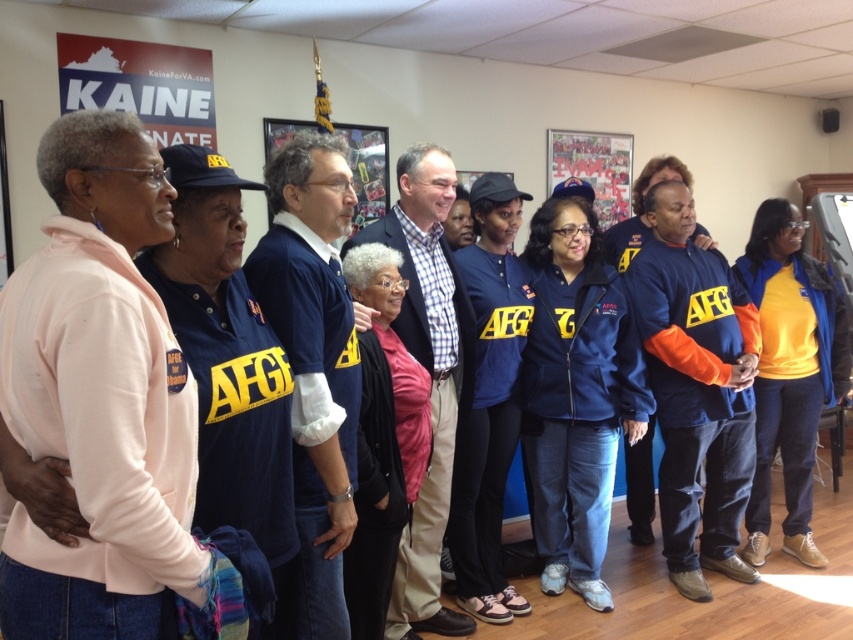
You are a photographer at the event and want to take a photo that includes both the pink fleece jacket at left and the orange fleece jacket at center. Which jacket should you move closer to the camera to ensure both are in focus?

The orange fleece jacket at center should be moved closer to the camera because the pink fleece jacket at left is already closer to the viewer. By bringing the orange fleece jacket at center to the same distance as the pink fleece jacket at left, both will be in focus.

You are organizing a photo shoot and need to arrange the pink fleece jacket at left and orange fleece jacket at center based on their heights. Which jacket should be placed in a position that requires a lower platform to accommodate its height?

The pink fleece jacket at left is shorter than the orange fleece jacket at center, so it should be placed on a lower platform to match its height.

You are standing at the point marked as point [767,237] in the image. You want to walk to the point marked as point [54,396]. Which direction should you move relative to your current position?

You should move forward because point [54,396] is in front of point [767,237].